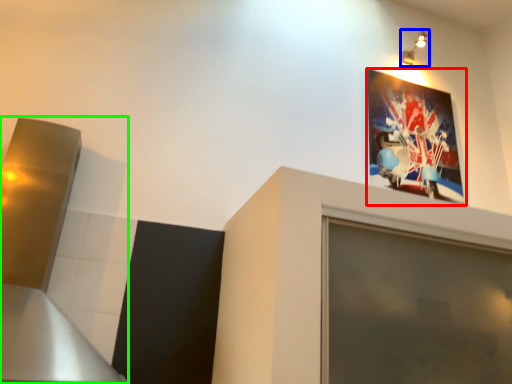
Question: Which object is positioned farthest from picture frame (highlighted by a red box)? Select from light fixture (highlighted by a blue box) and exhaust hood (highlighted by a green box).

Choices:
 (A) light fixture
 (B) exhaust hood

Answer: (B)